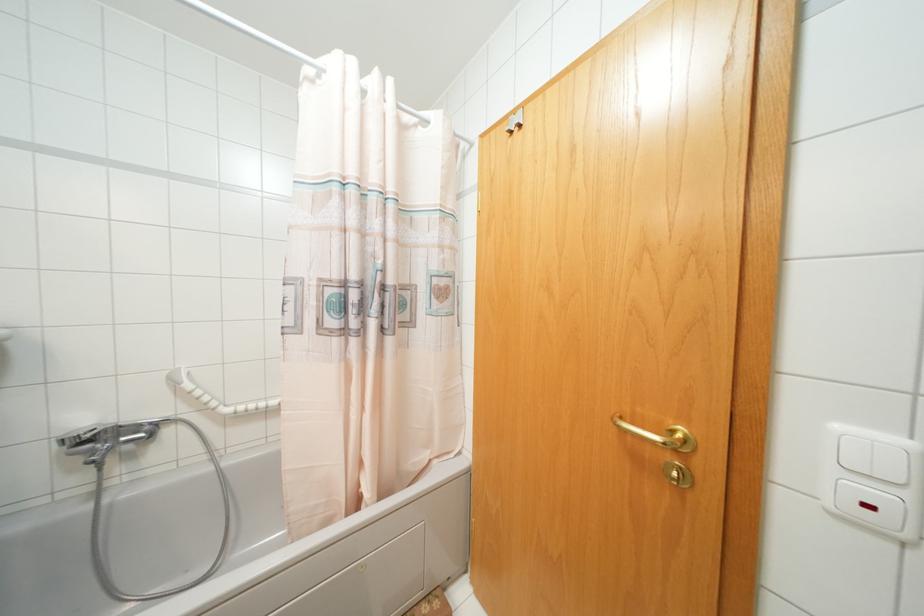
What do you see at coordinates (660, 435) in the screenshot? I see `the golden door handle` at bounding box center [660, 435].